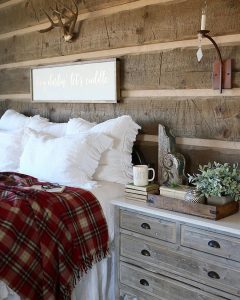
At what (x,y) coordinates should I click in order to perform the action: click on wall wooden brown dark. Please return your answer as a coordinate pair (x, y). Looking at the image, I should click on (137, 25).